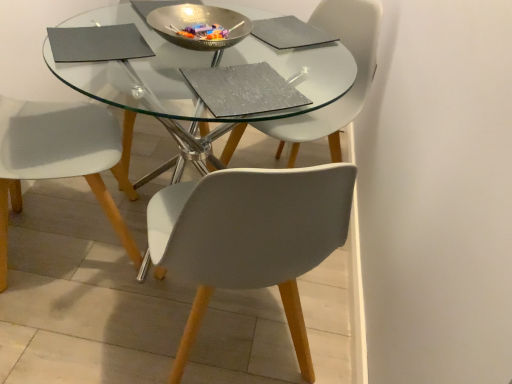
Describe the element at coordinates (59, 158) in the screenshot. I see `white matte chair at lower left, placed as the first chair when sorted from left to right` at that location.

I want to click on white matte chair at lower left, which is the second chair in right-to-left order, so click(x=59, y=158).

Based on the photo, is white matte chair at lower left, which is the second chair in right-to-left order, wider than metallic silver bowl at center?

Indeed, white matte chair at lower left, which is the second chair in right-to-left order, has a greater width compared to metallic silver bowl at center.

In the scene shown: Considering their positions, is white matte chair at lower left, which is the second chair in right-to-left order, located in front of or behind metallic silver bowl at center?

Clearly, white matte chair at lower left, which is the second chair in right-to-left order, is in front of metallic silver bowl at center.

In terms of height, does white matte chair at lower left, placed as the first chair when sorted from left to right, look taller or shorter compared to metallic silver bowl at center?

In the image, white matte chair at lower left, placed as the first chair when sorted from left to right, appears to be taller than metallic silver bowl at center.

In the scene shown: Is white matte chair at lower left, which is the second chair in right-to-left order, spatially inside metallic silver bowl at center, or outside of it?

white matte chair at lower left, which is the second chair in right-to-left order, is not enclosed by metallic silver bowl at center.

Considering the relative sizes of white matte chair at lower left, placed as the first chair when sorted from left to right, and matte gray chair at center, acting as the second chair starting from the left, in the image provided, is white matte chair at lower left, placed as the first chair when sorted from left to right, bigger than matte gray chair at center, acting as the second chair starting from the left,?

Yes, white matte chair at lower left, placed as the first chair when sorted from left to right, is bigger than matte gray chair at center, acting as the second chair starting from the left.

Is point (35, 160) positioned in front of point (347, 42)?

Yes, it is.

Does white matte chair at lower left, which is the second chair in right-to-left order, turn towards matte gray chair at center, acting as the second chair starting from the left?

Yes, white matte chair at lower left, which is the second chair in right-to-left order, is turned towards matte gray chair at center, acting as the second chair starting from the left.

Based on their positions, is white matte chair at lower left, which is the second chair in right-to-left order, located to the left or right of matte gray chair at center, the first chair in the right-to-left sequence?

A: Clearly, white matte chair at lower left, which is the second chair in right-to-left order, is on the left of matte gray chair at center, the first chair in the right-to-left sequence, in the image.

Does metallic silver bowl at center have a lesser height compared to white matte chair at lower left, placed as the first chair when sorted from left to right?

Yes, metallic silver bowl at center is shorter than white matte chair at lower left, placed as the first chair when sorted from left to right.

From the image's perspective, who appears lower, metallic silver bowl at center or white matte chair at lower left, which is the second chair in right-to-left order?

From the image's view, white matte chair at lower left, which is the second chair in right-to-left order, is below.

Relative to white matte chair at lower left, placed as the first chair when sorted from left to right, is metallic silver bowl at center in front or behind?

metallic silver bowl at center is positioned farther from the viewer than white matte chair at lower left, placed as the first chair when sorted from left to right.

Can you tell me how much metallic silver bowl at center and white matte chair at lower left, which is the second chair in right-to-left order, differ in facing direction?

The facing directions of metallic silver bowl at center and white matte chair at lower left, which is the second chair in right-to-left order, are 109 degrees apart.

Can you confirm if matte gray chair at center, the first chair in the right-to-left sequence, is thinner than metallic silver bowl at center?

In fact, matte gray chair at center, the first chair in the right-to-left sequence, might be wider than metallic silver bowl at center.

Who is bigger, matte gray chair at center, the first chair in the right-to-left sequence, or metallic silver bowl at center?

Bigger between the two is matte gray chair at center, the first chair in the right-to-left sequence.

Is matte gray chair at center, the first chair in the right-to-left sequence, to the left of metallic silver bowl at center from the viewer's perspective?

No, matte gray chair at center, the first chair in the right-to-left sequence, is not to the left of metallic silver bowl at center.

From a real-world perspective, who is located higher, matte gray chair at center, the first chair in the right-to-left sequence, or metallic silver bowl at center?

From a 3D spatial view, metallic silver bowl at center is above.

Is matte gray chair at center, acting as the second chair starting from the left, spatially inside white matte chair at lower left, which is the second chair in right-to-left order, or outside of it?

matte gray chair at center, acting as the second chair starting from the left, is located beyond the bounds of white matte chair at lower left, which is the second chair in right-to-left order.

Image resolution: width=512 pixels, height=384 pixels. I want to click on chair that appears below the matte gray chair at center, the first chair in the right-to-left sequence (from the image's perspective), so click(59, 158).

Is matte gray chair at center, acting as the second chair starting from the left, not close to white matte chair at lower left, placed as the first chair when sorted from left to right?

No, matte gray chair at center, acting as the second chair starting from the left, is not far from white matte chair at lower left, placed as the first chair when sorted from left to right.

Which object is further away from the camera taking this photo, matte gray chair at center, the first chair in the right-to-left sequence, or white matte chair at lower left, which is the second chair in right-to-left order?

Positioned behind is matte gray chair at center, the first chair in the right-to-left sequence.

Is metallic silver bowl at center far from matte gray chair at center, the first chair in the right-to-left sequence?

metallic silver bowl at center is actually quite close to matte gray chair at center, the first chair in the right-to-left sequence.

From a real-world perspective, is metallic silver bowl at center physically located above or below matte gray chair at center, acting as the second chair starting from the left?

Clearly, from a real-world perspective, metallic silver bowl at center is above matte gray chair at center, acting as the second chair starting from the left.

From a real-world perspective, starting from the metallic silver bowl at center, which chair is the 2nd one below it? Please provide its 2D coordinates.

[(350, 88)]

Can you confirm if metallic silver bowl at center is taller than matte gray chair at center, the first chair in the right-to-left sequence?

In fact, metallic silver bowl at center may be shorter than matte gray chair at center, the first chair in the right-to-left sequence.

Where is `chair on the left side of metallic silver bowl at center`? chair on the left side of metallic silver bowl at center is located at coordinates (59, 158).

The width and height of the screenshot is (512, 384). Identify the location of chair lying behind the white matte chair at lower left, placed as the first chair when sorted from left to right. (350, 88).

When comparing their distances from matte gray chair at center, the first chair in the right-to-left sequence, does white matte chair at lower left, placed as the first chair when sorted from left to right, or metallic silver bowl at center seem further?

white matte chair at lower left, placed as the first chair when sorted from left to right.

Looking at the image, which one is located further to white matte chair at lower left, placed as the first chair when sorted from left to right, matte gray chair at center, the first chair in the right-to-left sequence, or metallic silver bowl at center?

matte gray chair at center, the first chair in the right-to-left sequence, is further to white matte chair at lower left, placed as the first chair when sorted from left to right.

Estimate the real-world distances between objects in this image. Which object is further from matte gray chair at center, the first chair in the right-to-left sequence, metallic silver bowl at center or white matte chair at lower left, which is the second chair in right-to-left order?

white matte chair at lower left, which is the second chair in right-to-left order, is further to matte gray chair at center, the first chair in the right-to-left sequence.

Estimate the real-world distances between objects in this image. Which object is further from white matte chair at lower left, which is the second chair in right-to-left order, metallic silver bowl at center or matte gray chair at center, the first chair in the right-to-left sequence?

The object further to white matte chair at lower left, which is the second chair in right-to-left order, is matte gray chair at center, the first chair in the right-to-left sequence.

Looking at the image, which one is located further to metallic silver bowl at center, white matte chair at lower left, which is the second chair in right-to-left order, or matte gray chair at center, acting as the second chair starting from the left?

white matte chair at lower left, which is the second chair in right-to-left order, is further to metallic silver bowl at center.

When comparing their distances from metallic silver bowl at center, does matte gray chair at center, the first chair in the right-to-left sequence, or white matte chair at lower left, placed as the first chair when sorted from left to right, seem further?

white matte chair at lower left, placed as the first chair when sorted from left to right, is further to metallic silver bowl at center.

This screenshot has width=512, height=384. Find the location of `bowl between white matte chair at lower left, which is the second chair in right-to-left order, and matte gray chair at center, the first chair in the right-to-left sequence, in the horizontal direction`. bowl between white matte chair at lower left, which is the second chair in right-to-left order, and matte gray chair at center, the first chair in the right-to-left sequence, in the horizontal direction is located at coordinates (198, 23).